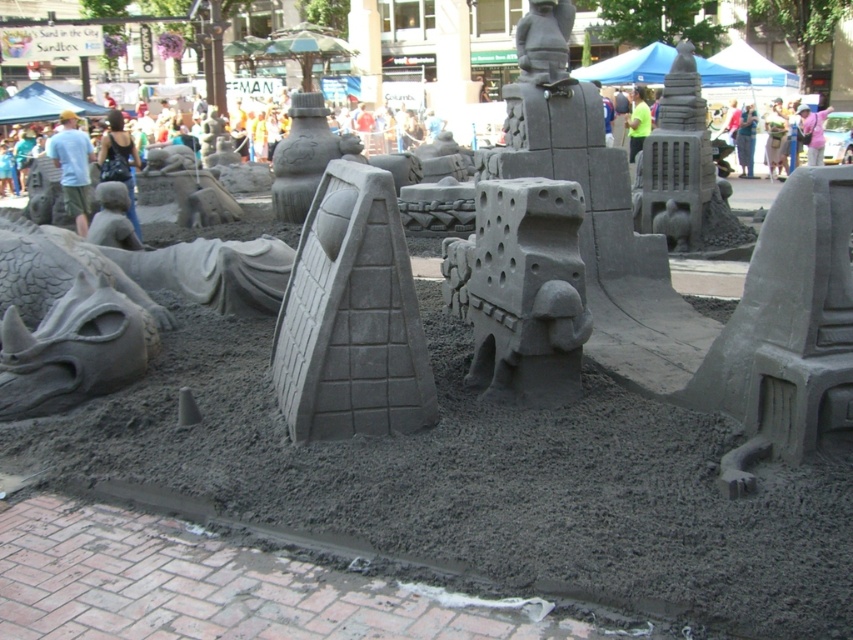
Looking at this image, you are standing in front of the sand sculpture installation and want to take a photo of both the gray sandcastle at center and the gray stone tower at center. Which one will appear larger in your photo?

The gray sandcastle at center will appear larger in your photo because it is closer to the viewer than the gray stone tower at center.

You are a sand sculptor who wants to place a new decorative flag on the highest point of the gray sandcastle at center and gray stone tower at center. Based on their positions, which object should you choose to place the flag on top?

The gray stone tower at center is higher than the gray sandcastle at center, so you should place the flag on top of the gray stone tower at center.